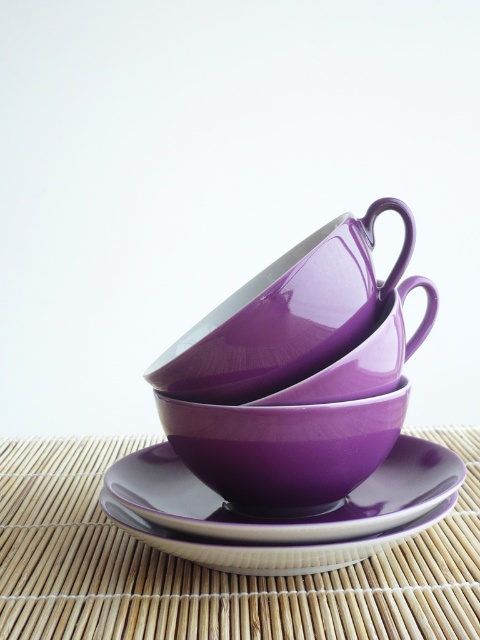
Is point (188, 541) behind point (345, 396)?

That is False.

Which is above, white glossy plate at center or glossy purple teacup at center?

glossy purple teacup at center is higher up.

What do you see at coordinates (266, 545) in the screenshot? I see `white glossy plate at center` at bounding box center [266, 545].

You are a GUI agent. You are given a task and a screenshot of the screen. Output one action in this format:
    pyautogui.click(x=<x>, y=<y>)
    Task: Click on the white glossy plate at center
    
    Given the screenshot: What is the action you would take?
    pyautogui.click(x=266, y=545)

Is point (132, 484) in front of point (396, 532)?

No.

Who is more distant from viewer, (236,532) or (290,564)?

The point (290,564) is more distant.

Which is in front, point (388, 452) or point (167, 531)?

Point (167, 531) is in front.

You are a GUI agent. You are given a task and a screenshot of the screen. Output one action in this format:
    pyautogui.click(x=<x>, y=<y>)
    Task: Click on the purple glossy saucer at center
    This screenshot has width=480, height=640.
    Given the screenshot: What is the action you would take?
    pyautogui.click(x=288, y=515)

Is glossy ceramic teacup at center below white glossy plate at center?

No, glossy ceramic teacup at center is not below white glossy plate at center.

Identify the location of glossy ceramic teacup at center. (287, 316).

Is point (351, 291) positioned behind point (333, 547)?

Yes, it is.

Find the location of a particular element. glossy ceramic teacup at center is located at coordinates (287, 316).